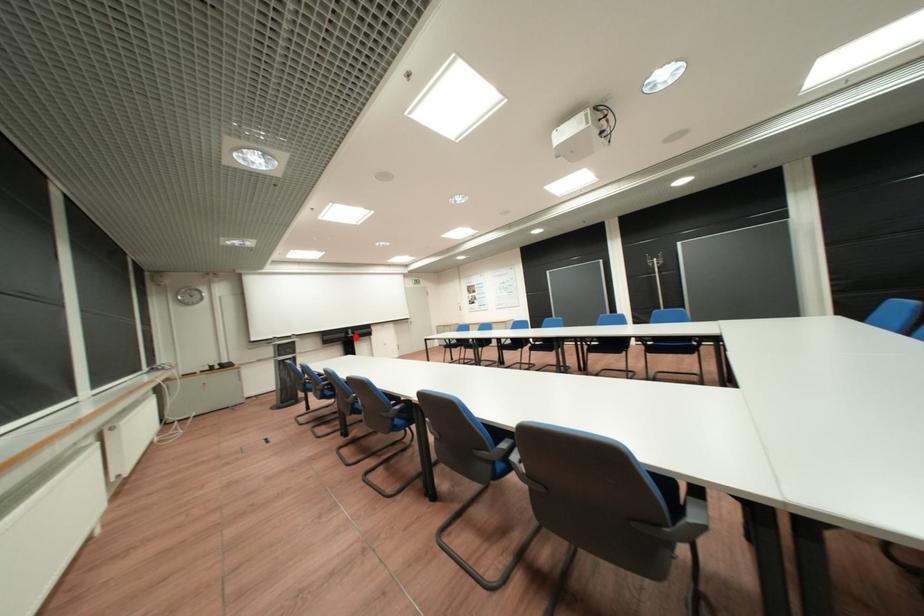
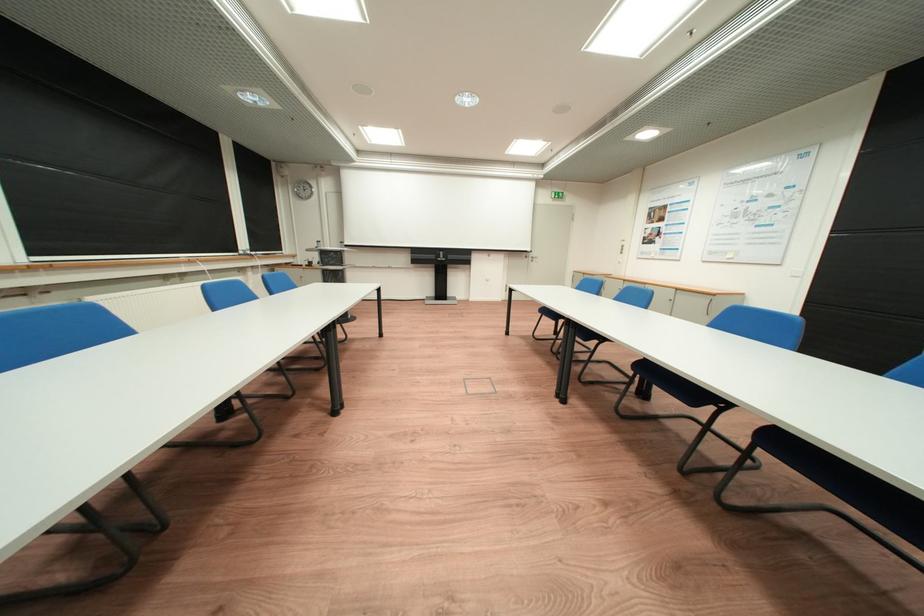
Question: I am providing you with two images of the same scene from different viewpoints. Image1 has a red point marked. In image2, the corresponding 3D location appears at what relative position? Reply with the corresponding letter.

Choices:
 (A) Closer
 (B) Farther

Answer: (A)